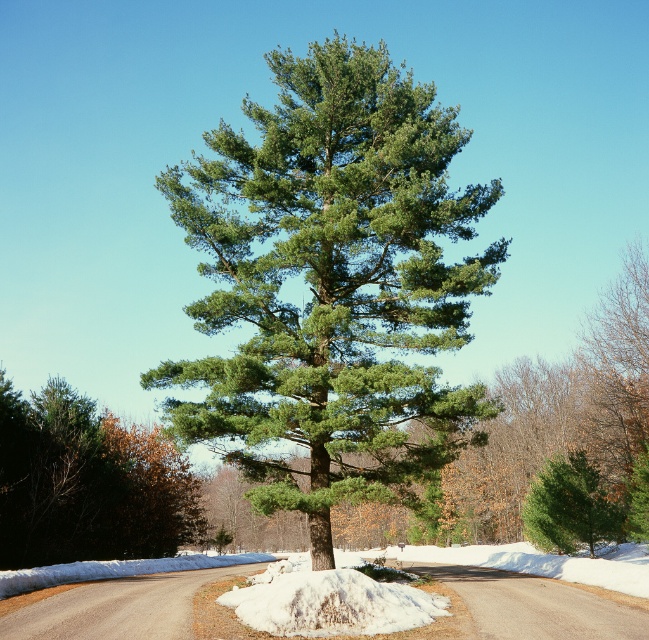
You are a hiker trying to navigate through the snowy road. You see the green matte tree at center and the green matte evergreen tree at center. Which tree should you avoid walking near to stay on the road?

You should avoid walking near the green matte tree at center because it is larger in size than the green matte evergreen tree at center and might block the path.